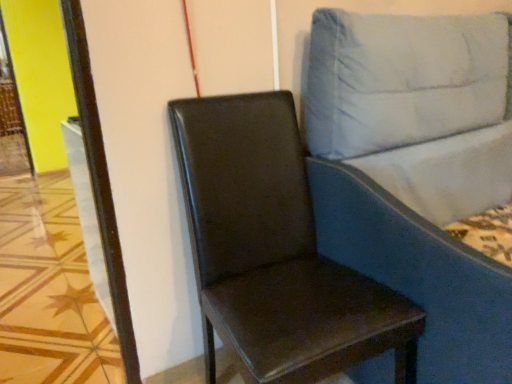
Question: Would you consider glossy brown leather chair at center to be distant from blue fabric studio couch at right?

Choices:
 (A) no
 (B) yes

Answer: (A)

Question: Does glossy brown leather chair at center have a larger size compared to blue fabric studio couch at right?

Choices:
 (A) no
 (B) yes

Answer: (A)

Question: Does glossy brown leather chair at center have a greater width compared to blue fabric studio couch at right?

Choices:
 (A) no
 (B) yes

Answer: (A)

Question: From a real-world perspective, is glossy brown leather chair at center beneath blue fabric studio couch at right?

Choices:
 (A) no
 (B) yes

Answer: (B)

Question: Is glossy brown leather chair at center to the left of blue fabric studio couch at right from the viewer's perspective?

Choices:
 (A) no
 (B) yes

Answer: (B)

Question: Does glossy brown leather chair at center have a lesser height compared to blue fabric studio couch at right?

Choices:
 (A) yes
 (B) no

Answer: (A)

Question: Is glossy brown leather chair at center at the back of blue fabric studio couch at right?

Choices:
 (A) yes
 (B) no

Answer: (B)

Question: From the image's perspective, does blue fabric studio couch at right appear lower than glossy brown leather chair at center?

Choices:
 (A) no
 (B) yes

Answer: (A)

Question: Considering the relative sizes of blue fabric studio couch at right and glossy brown leather chair at center in the image provided, is blue fabric studio couch at right taller than glossy brown leather chair at center?

Choices:
 (A) no
 (B) yes

Answer: (B)

Question: Is blue fabric studio couch at right smaller than glossy brown leather chair at center?

Choices:
 (A) yes
 (B) no

Answer: (B)

Question: Is blue fabric studio couch at right bigger than glossy brown leather chair at center?

Choices:
 (A) no
 (B) yes

Answer: (B)

Question: Does blue fabric studio couch at right appear on the right side of glossy brown leather chair at center?

Choices:
 (A) yes
 (B) no

Answer: (A)

Question: Is blue fabric studio couch at right inside or outside of glossy brown leather chair at center?

Choices:
 (A) outside
 (B) inside

Answer: (A)